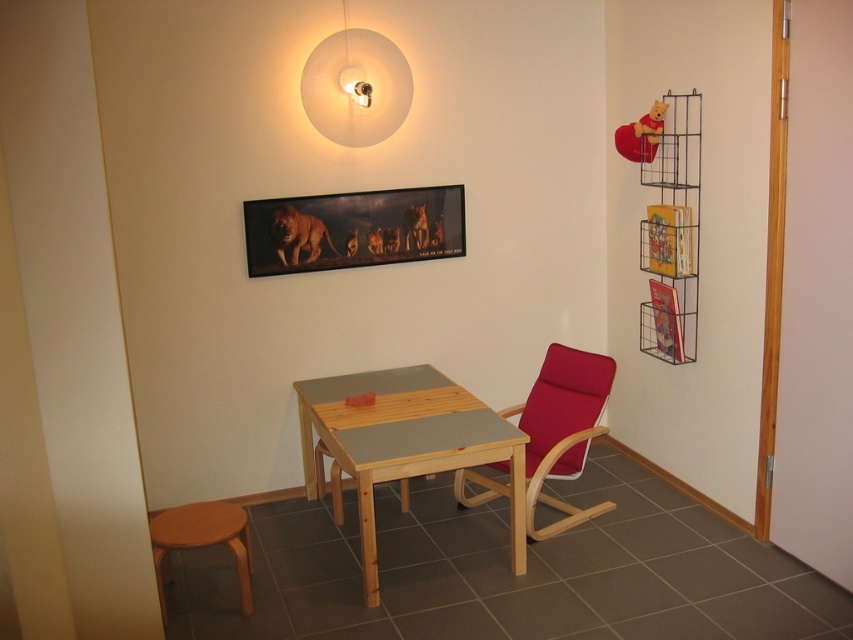
Looking at this image, you are sitting on the matte red chair at center and want to turn on the light. Which direction should you look to find the white matte lampshade at upper center?

Since the matte red chair at center is in front of the white matte lampshade at upper center, you should look behind you to find the white matte lampshade at upper center.

You are standing in the room and want to place a new item on the table located at point (405, 442). Which object is at that coordinate?

The light brown wooden table at center is located at point (405, 442).